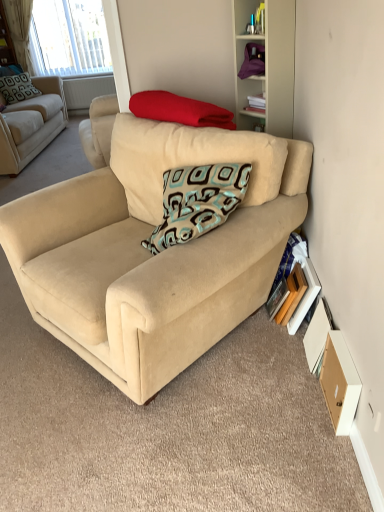
Where is `vacant area that is in front of wooden drawer at lower right`? vacant area that is in front of wooden drawer at lower right is located at coordinates (327, 448).